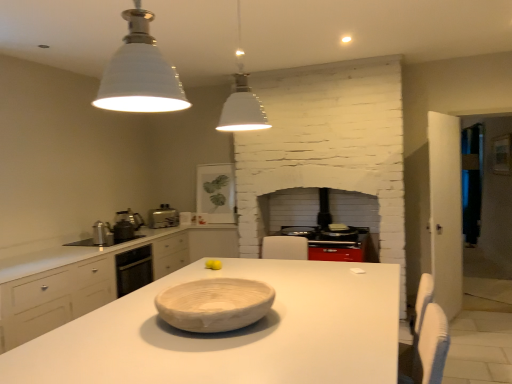
The image size is (512, 384). I want to click on transparent glass door at right, so click(471, 182).

Where is `metallic silver kettle at left, acting as the 2th appliance starting from the back`? The image size is (512, 384). metallic silver kettle at left, acting as the 2th appliance starting from the back is located at coordinates (130, 218).

Describe the element at coordinates (130, 218) in the screenshot. I see `metallic silver kettle at left, which ranks as the fourth appliance in front-to-back order` at that location.

What is the approximate height of yellow matte tennis ball at center?

yellow matte tennis ball at center is 2.71 inches in height.

Find the location of `white matte pendant light at upper center, the 1th light fixture when ordered from back to front`. white matte pendant light at upper center, the 1th light fixture when ordered from back to front is located at coordinates pos(242,99).

Is point (186, 325) farther from viewer compared to point (310, 233)?

No.

From the image's perspective, does natural wood bowl at center appear higher than black glass stove at center, marked as the 1th appliance in a right-to-left arrangement?

No.

Is the position of natural wood bowl at center more distant than that of black glass stove at center, marked as the 1th appliance in a right-to-left arrangement?

No, the depth of natural wood bowl at center is less than that of black glass stove at center, marked as the 1th appliance in a right-to-left arrangement.

Considering the relative sizes of natural wood bowl at center and black glass stove at center, which is counted as the 5th appliance, starting from the left, in the image provided, is natural wood bowl at center smaller than black glass stove at center, which is counted as the 5th appliance, starting from the left,?

No, natural wood bowl at center is not smaller than black glass stove at center, which is counted as the 5th appliance, starting from the left.

Is yellow matte tennis ball at center in front of or behind matte white framed picture at upper center, arranged as the 4th appliance when viewed from the left, in the image?

yellow matte tennis ball at center is positioned closer to the viewer than matte white framed picture at upper center, arranged as the 4th appliance when viewed from the left.

Is yellow matte tennis ball at center situated inside matte white framed picture at upper center, arranged as the 4th appliance when viewed from the left, or outside?

yellow matte tennis ball at center is outside matte white framed picture at upper center, arranged as the 4th appliance when viewed from the left.

Does point (211, 265) come closer to viewer compared to point (225, 203)?

Yes, it is in front of point (225, 203).

The height and width of the screenshot is (384, 512). What are the coordinates of `food lying below the matte white framed picture at upper center, arranged as the 4th appliance when viewed from the left (from the image's perspective)` in the screenshot? It's located at [x=213, y=264].

Does metallic silver toaster at center-left have a larger size compared to matte white framed picture at upper center, marked as the second appliance in a right-to-left arrangement?

Incorrect, metallic silver toaster at center-left is not larger than matte white framed picture at upper center, marked as the second appliance in a right-to-left arrangement.

Considering the sizes of objects metallic silver toaster at center-left and matte white framed picture at upper center, which is the 1th appliance from back to front, in the image provided, who is wider, metallic silver toaster at center-left or matte white framed picture at upper center, which is the 1th appliance from back to front,?

With larger width is metallic silver toaster at center-left.

Is point (158, 221) positioned behind point (219, 205)?

No, it is not.

What's the angular difference between metallic silver toaster at center-left and matte white framed picture at upper center, marked as the second appliance in a right-to-left arrangement,'s facing directions?

The angular difference between metallic silver toaster at center-left and matte white framed picture at upper center, marked as the second appliance in a right-to-left arrangement, is 52.4 degrees.

Is point (151, 210) farther from camera compared to point (219, 265)?

Yes, it is.

Are metallic silver toaster at center-left and yellow matte tennis ball at center beside each other?

metallic silver toaster at center-left and yellow matte tennis ball at center are not in contact.

Is metallic silver toaster at center-left inside or outside of yellow matte tennis ball at center?

metallic silver toaster at center-left is outside yellow matte tennis ball at center.

Considering the sizes of objects metallic silver toaster at center-left and yellow matte tennis ball at center in the image provided, who is taller, metallic silver toaster at center-left or yellow matte tennis ball at center?

Standing taller between the two is metallic silver toaster at center-left.

I want to click on the 1st appliance behind the white matte pendant light at upper center, the 1th light fixture when ordered from back to front, so click(x=100, y=233).

From a real-world perspective, between satin silver kettle at left, acting as the fifth appliance starting from the back, and white matte pendant light at upper center, arranged as the second light fixture when viewed from the front, who is vertically lower?

satin silver kettle at left, acting as the fifth appliance starting from the back, is physically lower.

Is satin silver kettle at left, the first appliance when ordered from front to back, located outside white matte pendant light at upper center, the 1th light fixture when ordered from back to front?

Yes, satin silver kettle at left, the first appliance when ordered from front to back, is located beyond the bounds of white matte pendant light at upper center, the 1th light fixture when ordered from back to front.

Relative to white matte pendant light at upper center, the 1th light fixture when ordered from back to front, is satin silver kettle at left, acting as the fifth appliance starting from the back, in front or behind?

Visually, satin silver kettle at left, acting as the fifth appliance starting from the back, is located behind white matte pendant light at upper center, the 1th light fixture when ordered from back to front.

Can you confirm if white matte countertop at center is thinner than satin silver kettle at left, which is counted as the fifth appliance, starting from the right?

No, white matte countertop at center is not thinner than satin silver kettle at left, which is counted as the fifth appliance, starting from the right.

Considering the relative sizes of white matte countertop at center and satin silver kettle at left, which is counted as the fifth appliance, starting from the right, in the image provided, is white matte countertop at center smaller than satin silver kettle at left, which is counted as the fifth appliance, starting from the right,?

No, white matte countertop at center is not smaller than satin silver kettle at left, which is counted as the fifth appliance, starting from the right.

How distant is white matte countertop at center from satin silver kettle at left, acting as the fifth appliance starting from the back?

white matte countertop at center and satin silver kettle at left, acting as the fifth appliance starting from the back, are 7.70 feet apart from each other.

Does white matte countertop at center contain satin silver kettle at left, the first appliance when ordered from front to back?

That's incorrect, satin silver kettle at left, the first appliance when ordered from front to back, is not inside white matte countertop at center.

Who is taller, white matte countertop at center or metallic silver kettle at left, acting as the 4th appliance starting from the back?

white matte countertop at center is taller.

Does white matte countertop at center have a greater width compared to metallic silver kettle at left, the third appliance when ordered from left to right?

Yes.

Does point (278, 358) appear closer or farther from the camera than point (134, 233)?

Clearly, point (278, 358) is closer to the camera than point (134, 233).

Locate an element on the screen. Image resolution: width=512 pixels, height=384 pixels. bowl that is in front of the black glass stove at center, acting as the 3th appliance starting from the front is located at coordinates (215, 304).

The width and height of the screenshot is (512, 384). I want to click on the 1st appliance to the left of the yellow matte tennis ball at center, counting from the anchor's position, so click(216, 192).

When comparing their distances from metallic silver kettle at left, the third appliance when ordered from left to right, does yellow matte tennis ball at center or white matte pendant light at upper center, the 1th light fixture when ordered from back to front, seem further?

yellow matte tennis ball at center.

Based on their spatial positions, is white matte countertop at center or white matte pendant light at upper center, arranged as the second light fixture when viewed from the front, further from satin silver kettle at left, acting as the fifth appliance starting from the back?

The object further to satin silver kettle at left, acting as the fifth appliance starting from the back, is white matte countertop at center.

Looking at this image, when comparing their distances from white ceramic light fixture at upper center, which is counted as the second light fixture, starting from the back, does black glass stove at center, marked as the 1th appliance in a right-to-left arrangement, or matte white framed picture at upper center, which is the 1th appliance from back to front, seem further?

Among the two, matte white framed picture at upper center, which is the 1th appliance from back to front, is located further to white ceramic light fixture at upper center, which is counted as the second light fixture, starting from the back.

Considering their positions, is white matte countertop at center positioned closer to natural wood bowl at center than transparent glass door at right?

white matte countertop at center is closer to natural wood bowl at center.

Based on their spatial positions, is satin silver kettle at left, the 1th appliance positioned from the left, or natural wood bowl at center closer to black glass stove at center, marked as the 1th appliance in a right-to-left arrangement?

Among the two, satin silver kettle at left, the 1th appliance positioned from the left, is located nearer to black glass stove at center, marked as the 1th appliance in a right-to-left arrangement.

When comparing their distances from metallic silver kettle at left, which ranks as the fourth appliance in front-to-back order, does metallic silver toaster at center-left or natural wood bowl at center seem closer?

metallic silver toaster at center-left is closer to metallic silver kettle at left, which ranks as the fourth appliance in front-to-back order.

Looking at the image, which one is located closer to metallic silver kettle at left, the third appliance when ordered from left to right, metallic silver toaster at center-left or black glass stove at center, acting as the 3th appliance starting from the front?

metallic silver toaster at center-left lies closer to metallic silver kettle at left, the third appliance when ordered from left to right, than the other object.

Based on their spatial positions, is satin silver kettle at left, which is counted as the fifth appliance, starting from the right, or matte white framed picture at upper center, arranged as the 4th appliance when viewed from the left, closer to natural wood bowl at center?

→ Based on the image, satin silver kettle at left, which is counted as the fifth appliance, starting from the right, appears to be nearer to natural wood bowl at center.

Find the location of a particular element. This screenshot has height=384, width=512. food located between satin silver kettle at left, the first appliance when ordered from front to back, and black glass stove at center, acting as the 3th appliance starting from the front, in the left-right direction is located at coordinates (213, 264).

The image size is (512, 384). What are the coordinates of `food between white matte pendant light at upper center, arranged as the second light fixture when viewed from the front, and metallic silver toaster at center-left, along the z-axis` in the screenshot? It's located at (213, 264).

Find the location of a particular element. The image size is (512, 384). bowl between white ceramic light fixture at upper center, which appears as the first light fixture when viewed from the front, and black glass stove at center, which is counted as the 5th appliance, starting from the left, along the z-axis is located at coordinates (215, 304).

The width and height of the screenshot is (512, 384). I want to click on bowl between white ceramic light fixture at upper center, which is counted as the second light fixture, starting from the back, and satin silver kettle at left, the first appliance when ordered from front to back, along the z-axis, so click(215, 304).